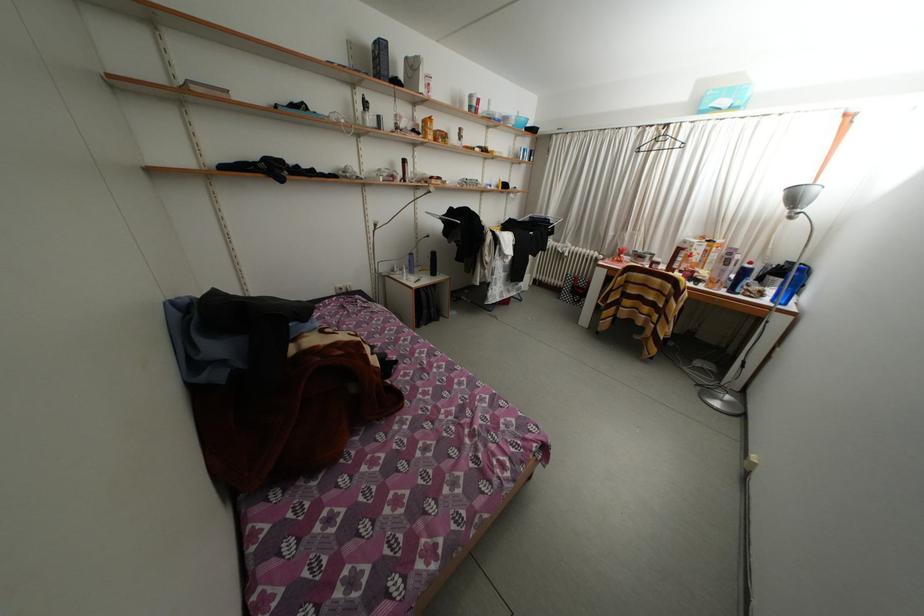
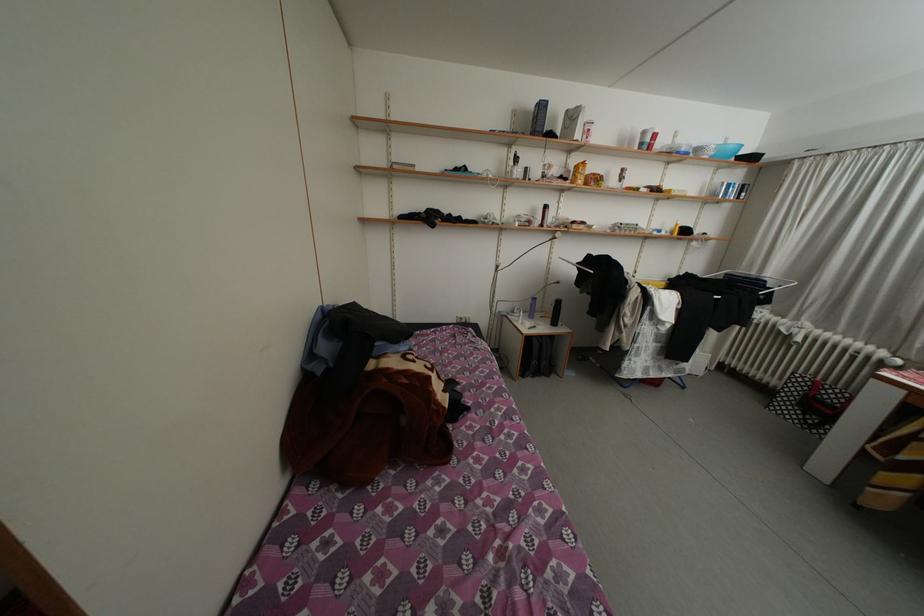
The point at (479,111) is marked in the first image. Where is the corresponding point in the second image?

(650, 148)